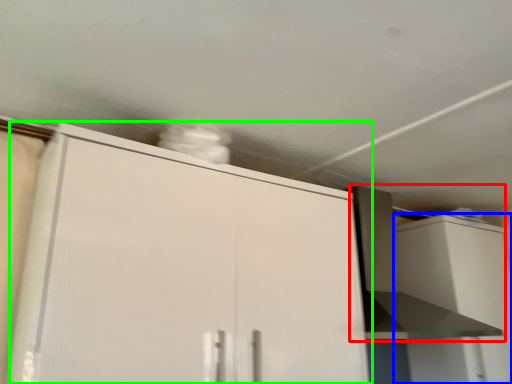
Question: Which object is the farthest from vent (highlighted by a red box)? Choose among these: cabinetry (highlighted by a blue box) or cabinetry (highlighted by a green box).

Choices:
 (A) cabinetry
 (B) cabinetry

Answer: (B)